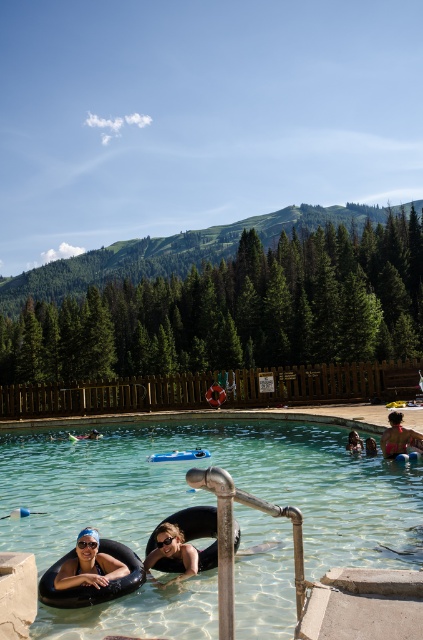
Does matte black swim ring at lower left appear under smooth skin person at center?

No, matte black swim ring at lower left is not below smooth skin person at center.

Is point (77, 540) positioned before point (357, 442)?

Yes, it is.

What do you see at coordinates (88, 564) in the screenshot?
I see `matte black swim ring at lower left` at bounding box center [88, 564].

Identify the location of matte black swim ring at lower left. Image resolution: width=423 pixels, height=640 pixels. (88, 564).

Does clear plastic pool at center come in front of matte black swim ring at lower center?

Yes, it is.

Is clear plastic pool at center to the left of matte black swim ring at lower center from the viewer's perspective?

Yes, clear plastic pool at center is to the left of matte black swim ring at lower center.

The width and height of the screenshot is (423, 640). Describe the element at coordinates (206, 492) in the screenshot. I see `clear plastic pool at center` at that location.

Locate an element on the screen. The width and height of the screenshot is (423, 640). clear plastic pool at center is located at coordinates (x=206, y=492).

Is clear plastic pool at center to the right of matte black swim ring at lower left from the viewer's perspective?

Correct, you'll find clear plastic pool at center to the right of matte black swim ring at lower left.

Is point (253, 525) closer to viewer compared to point (90, 561)?

No, it is behind (90, 561).

Is point (79, 513) positioned in front of point (101, 570)?

No.

Identify the location of clear plastic pool at center. (206, 492).